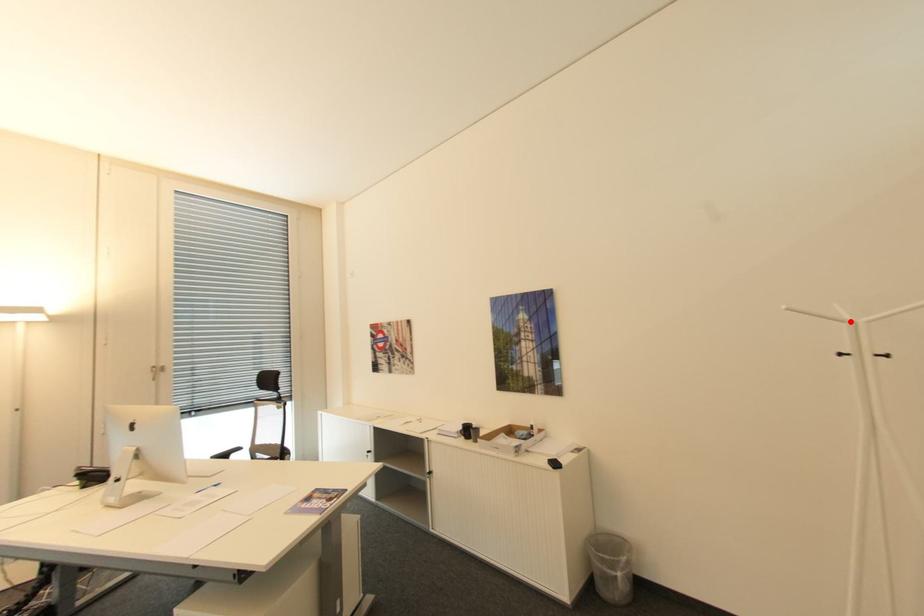
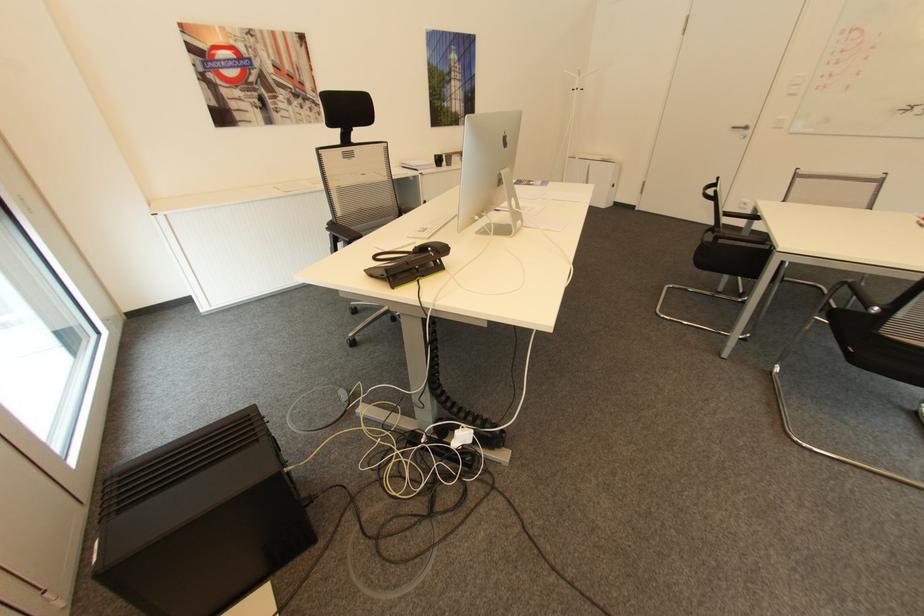
In the second image, find the point that corresponds to the highlighted location in the first image.

(582, 76)